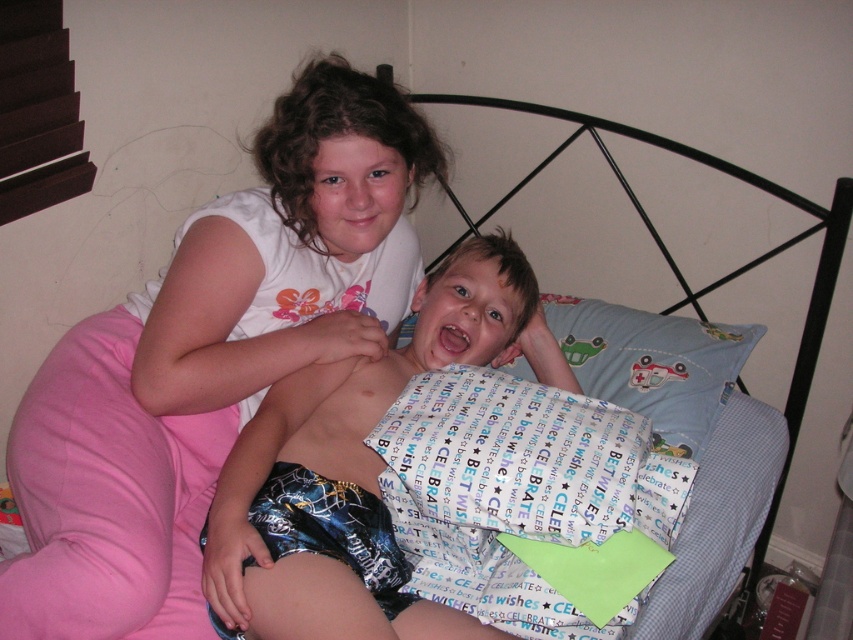
Between point (496, 330) and point (549, 321), which one is positioned in front?

Point (496, 330) is in front.

Locate an element on the screen. blue printed shorts at center is located at coordinates (357, 467).